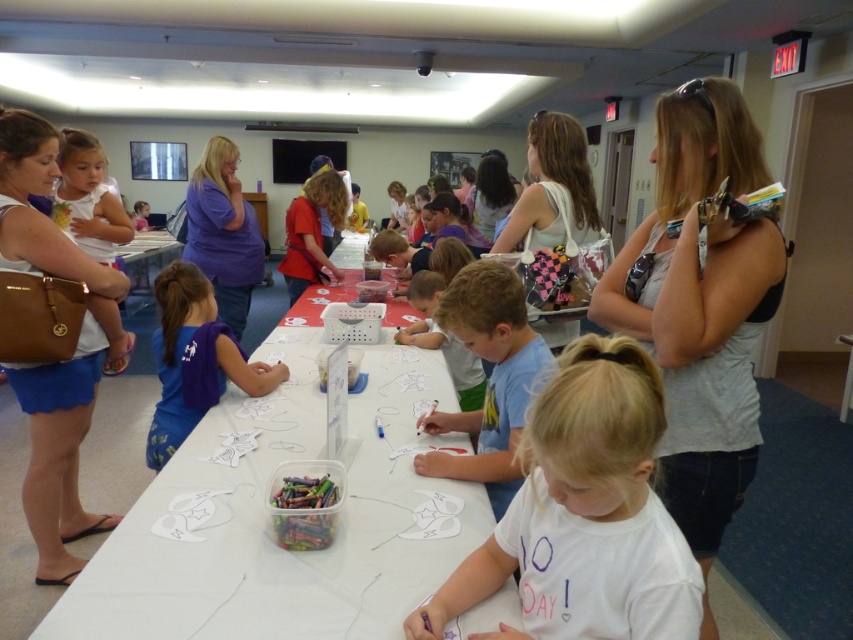
Question: Which of the following is the farthest from the observer?

Choices:
 (A) white paper at center
 (B) white paper table at center

Answer: (B)

Question: Does white matte shirt at upper left appear on the right side of clear plastic table at center?

Choices:
 (A) yes
 (B) no

Answer: (A)

Question: Does white paper table at center have a lesser width compared to white paper at center?

Choices:
 (A) yes
 (B) no

Answer: (B)

Question: Which object is the closest to the light blue shirt at center?

Choices:
 (A) white matte shirt at upper left
 (B) matte red shirt at center
 (C) white paper table at center

Answer: (C)

Question: Can you confirm if matte red shirt at center is positioned below light blue shirt at center?

Choices:
 (A) yes
 (B) no

Answer: (B)

Question: Which of the following is the closest to the observer?

Choices:
 (A) (67, 228)
 (B) (294, 353)
 (C) (306, 216)

Answer: (B)